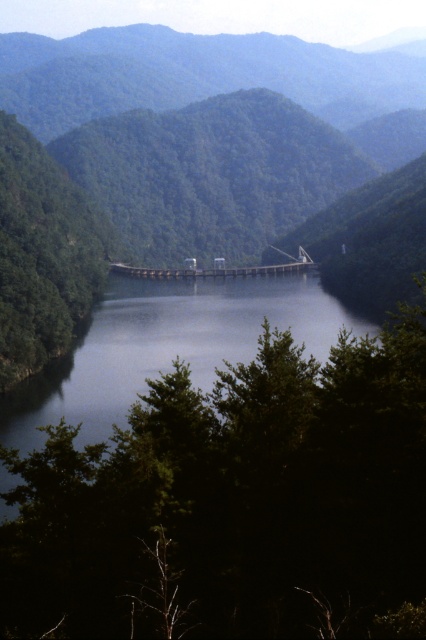
You are standing at the edge of the reservoir and want to walk to the concrete bridge at center. There is a green leafy tree at center blocking your path. Can you walk around the tree to reach the bridge?

The green leafy tree at center is closer to the viewer than the concrete bridge at center, so you can walk around the tree to reach the concrete bridge at center.

You are standing in the serene landscape and see the green leafy tree at center and the green matte tree at center. Which tree is positioned to the right of the other?

The green leafy tree at center is positioned to the right of the green matte tree at center.